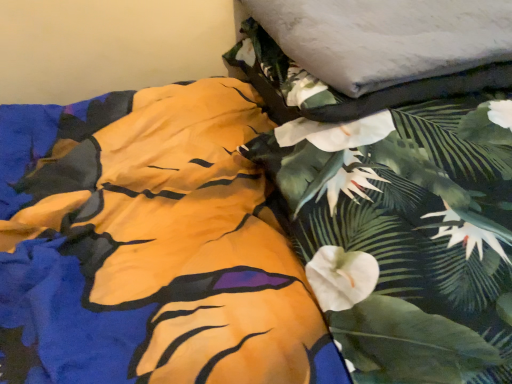
In order to face white satin bedsheet at upper center, should I rotate leftwards or rightwards?

You should rotate right by 16.847 degrees.

What do you see at coordinates (386, 38) in the screenshot? I see `white satin bedsheet at upper center` at bounding box center [386, 38].

You are a GUI agent. You are given a task and a screenshot of the screen. Output one action in this format:
    pyautogui.click(x=<x>, y=<y>)
    Task: Click on the white satin bedsheet at upper center
    The height and width of the screenshot is (384, 512).
    Given the screenshot: What is the action you would take?
    pyautogui.click(x=386, y=38)

Where is `white satin bedsheet at upper center`? This screenshot has height=384, width=512. white satin bedsheet at upper center is located at coordinates (386, 38).